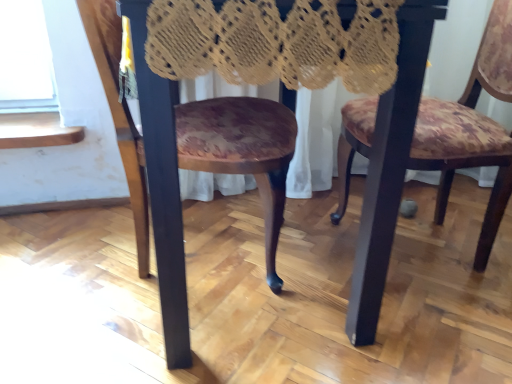
This screenshot has height=384, width=512. Find the location of `unoccupied space behind floral fabric chair at center, which is the first chair in right-to-left order`. unoccupied space behind floral fabric chair at center, which is the first chair in right-to-left order is located at coordinates (398, 198).